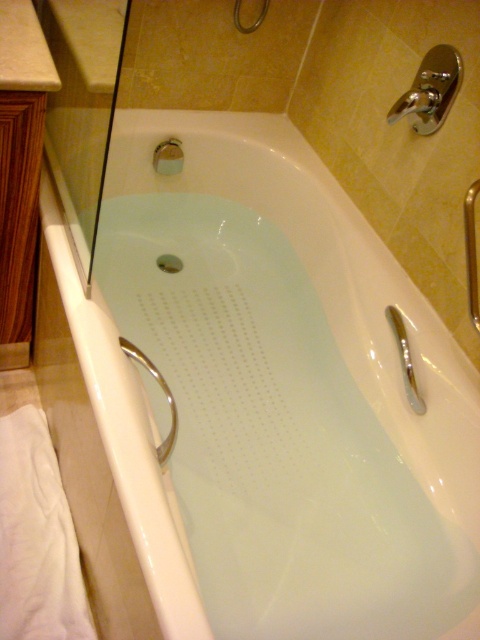
Which is more to the left, polished chrome shower head at upper right or silver metallic faucet at right?

silver metallic faucet at right is more to the left.

Locate an element on the screen. polished chrome shower head at upper right is located at coordinates (431, 90).

Who is higher up, white glossy sink at upper left or polished chrome shower head at upper right?

Positioned higher is white glossy sink at upper left.

Which is more to the left, white glossy sink at upper left or polished chrome shower head at upper right?

white glossy sink at upper left is more to the left.

Is point (108, 92) farther from viewer compared to point (430, 113)?

That is False.

This screenshot has width=480, height=640. What are the coordinates of `white glossy sink at upper left` in the screenshot? It's located at (93, 36).

Does polished chrome shower head at upper right have a lesser height compared to matte silver showerhead at upper center?

No, polished chrome shower head at upper right is not shorter than matte silver showerhead at upper center.

Who is shorter, polished chrome shower head at upper right or matte silver showerhead at upper center?

With less height is matte silver showerhead at upper center.

Locate an element on the screen. This screenshot has width=480, height=640. polished chrome shower head at upper right is located at coordinates (431, 90).